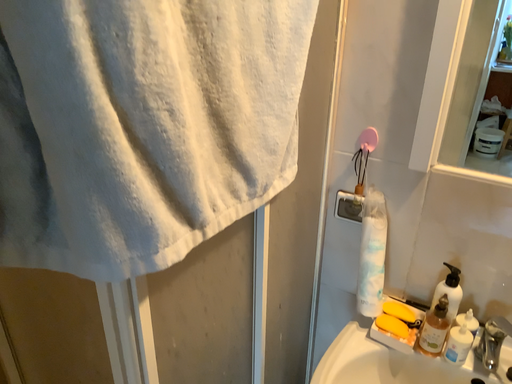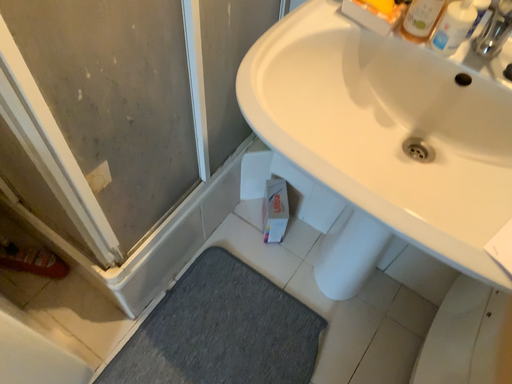
Question: How did the camera likely rotate when shooting the video?

Choices:
 (A) rotated downward
 (B) rotated upward

Answer: (A)